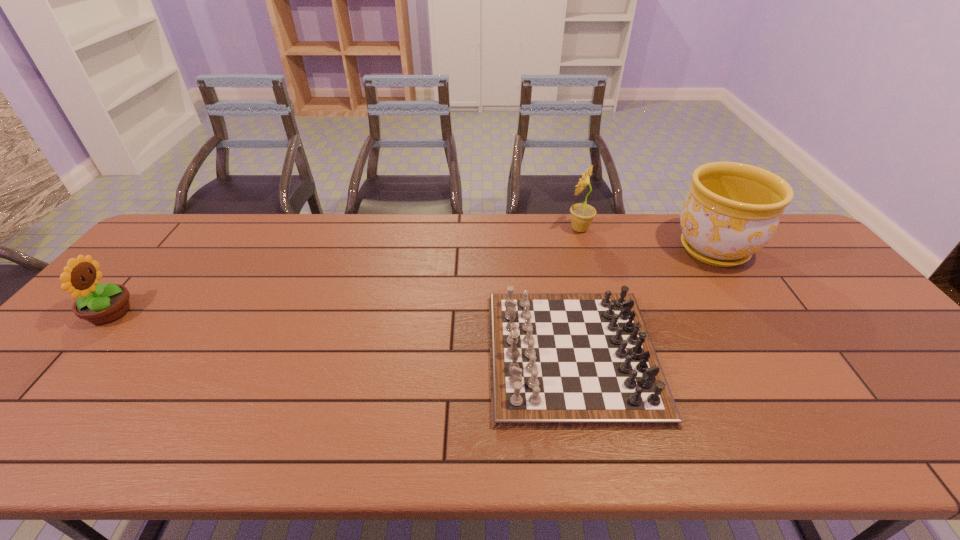
Where is `vacant space located on the face of the leftmost object`? vacant space located on the face of the leftmost object is located at coordinates (169, 313).

This screenshot has height=540, width=960. Find the location of `vacant region located 0.350m from the player's perspective of the chessboard`. vacant region located 0.350m from the player's perspective of the chessboard is located at coordinates [x=348, y=355].

At what (x,y) coordinates should I click in order to perform the action: click on vacant region located 0.320m from the player's perspective of the chessboard. Please return your answer as a coordinate pair (x, y). Looking at the image, I should click on (360, 355).

Where is `vacant space situated from the player's perspective of the chessboard`? vacant space situated from the player's perspective of the chessboard is located at coordinates (348, 355).

Where is `flowerpot that is at the far edge`? The image size is (960, 540). flowerpot that is at the far edge is located at coordinates (732, 210).

Locate an element on the screen. This screenshot has width=960, height=540. sunflower that is at the far edge is located at coordinates (582, 215).

Where is `object that is at the near edge`? object that is at the near edge is located at coordinates (558, 361).

At what (x,y) coordinates should I click in order to perform the action: click on object present at the left edge. Please return your answer as a coordinate pair (x, y). This screenshot has height=540, width=960. Looking at the image, I should click on (100, 304).

What are the coordinates of `vacant space at the far edge of the desktop` in the screenshot? It's located at (255, 235).

You are a GUI agent. You are given a task and a screenshot of the screen. Output one action in this format:
    pyautogui.click(x=<x>, y=<y>)
    Task: Click on the blank space at the near edge of the desktop
    
    Given the screenshot: What is the action you would take?
    coord(556,453)